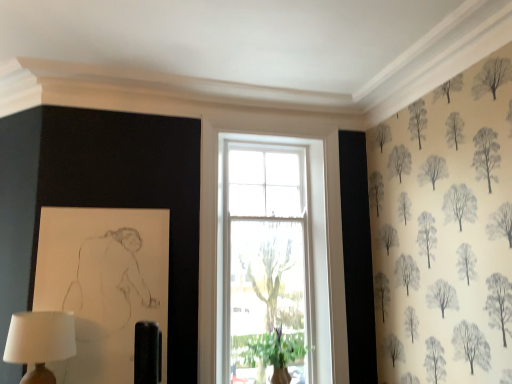
Question: Considering the relative positions of green leafy plant at window and matte white lampshade at lower left in the image provided, is green leafy plant at window to the left or to the right of matte white lampshade at lower left?

Choices:
 (A) left
 (B) right

Answer: (B)

Question: From a real-world perspective, is green leafy plant at window above or below matte white lampshade at lower left?

Choices:
 (A) below
 (B) above

Answer: (A)

Question: Considering the positions of green leafy plant at window and matte white lampshade at lower left in the image, is green leafy plant at window bigger or smaller than matte white lampshade at lower left?

Choices:
 (A) small
 (B) big

Answer: (B)

Question: Considering their positions, is matte white lampshade at lower left located in front of or behind green leafy plant at window?

Choices:
 (A) behind
 (B) front

Answer: (B)

Question: From their relative heights in the image, would you say matte white lampshade at lower left is taller or shorter than green leafy plant at window?

Choices:
 (A) tall
 (B) short

Answer: (B)

Question: Looking at the image, does matte white lampshade at lower left seem bigger or smaller compared to green leafy plant at window?

Choices:
 (A) small
 (B) big

Answer: (A)

Question: Is matte white lampshade at lower left to the left or to the right of green leafy plant at window in the image?

Choices:
 (A) right
 (B) left

Answer: (B)